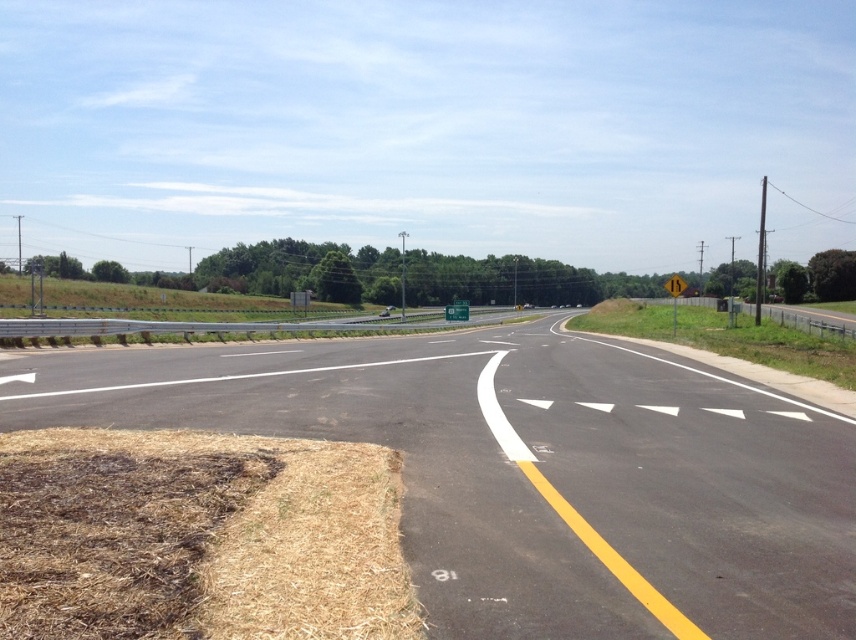
Can you confirm if brown dry grass at lower left is wider than green plastic sign at center?

In fact, brown dry grass at lower left might be narrower than green plastic sign at center.

Is brown dry grass at lower left closer to the viewer compared to green plastic sign at center?

Yes, it is.

Find the location of a particular element. This screenshot has height=640, width=856. brown dry grass at lower left is located at coordinates (199, 538).

At what (x,y) coordinates should I click in order to perform the action: click on brown dry grass at lower left. Please return your answer as a coordinate pair (x, y). This screenshot has height=640, width=856. Looking at the image, I should click on (199, 538).

Is asphalt road at center smaller than green plastic sign at center?

Correct, asphalt road at center occupies less space than green plastic sign at center.

Does asphalt road at center have a greater width compared to green plastic sign at center?

Indeed, asphalt road at center has a greater width compared to green plastic sign at center.

Is point (491, 467) in front of point (465, 312)?

Yes, point (491, 467) is in front of point (465, 312).

Where is `asphalt road at center`? The image size is (856, 640). asphalt road at center is located at coordinates (533, 472).

Is the position of asphalt road at center less distant than that of brown dry grass at lower left?

No, it is not.

Find the location of a particular element. The width and height of the screenshot is (856, 640). asphalt road at center is located at coordinates (533, 472).